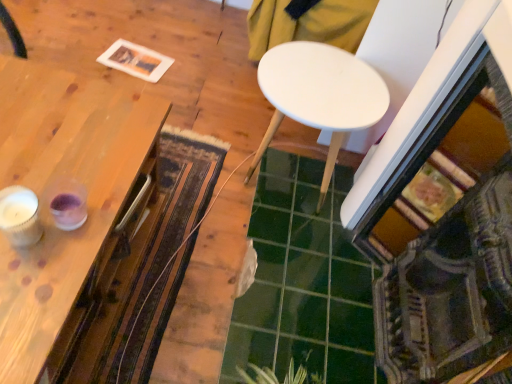
Question: Is green glossy tile at center aimed at white matte table at center, marked as the 2th table in a left-to-right arrangement?

Choices:
 (A) no
 (B) yes

Answer: (A)

Question: Is green glossy tile at center not within white matte table at center, which appears as the 1th table when viewed from the right?

Choices:
 (A) yes
 (B) no

Answer: (A)

Question: Considering the relative sizes of green glossy tile at center and white matte table at center, which appears as the 1th table when viewed from the right, in the image provided, is green glossy tile at center taller than white matte table at center, which appears as the 1th table when viewed from the right,?

Choices:
 (A) no
 (B) yes

Answer: (A)

Question: Can you confirm if green glossy tile at center is wider than white matte table at center, marked as the 2th table in a left-to-right arrangement?

Choices:
 (A) yes
 (B) no

Answer: (A)

Question: Are green glossy tile at center and white matte table at center, which appears as the 1th table when viewed from the right, making contact?

Choices:
 (A) no
 (B) yes

Answer: (A)

Question: Can you confirm if green glossy tile at center is thinner than white matte table at center, which appears as the 1th table when viewed from the right?

Choices:
 (A) no
 (B) yes

Answer: (A)

Question: Is green leafy plant at lower center positioned with its back to textured woolen mat at center?

Choices:
 (A) no
 (B) yes

Answer: (A)

Question: From the image's perspective, is green leafy plant at lower center beneath textured woolen mat at center?

Choices:
 (A) yes
 (B) no

Answer: (A)

Question: Does green leafy plant at lower center have a smaller size compared to textured woolen mat at center?

Choices:
 (A) yes
 (B) no

Answer: (A)

Question: Can you confirm if green leafy plant at lower center is thinner than textured woolen mat at center?

Choices:
 (A) no
 (B) yes

Answer: (B)

Question: Is green leafy plant at lower center at the left side of textured woolen mat at center?

Choices:
 (A) yes
 (B) no

Answer: (B)

Question: Is the depth of green leafy plant at lower center greater than that of textured woolen mat at center?

Choices:
 (A) yes
 (B) no

Answer: (B)

Question: Can you confirm if textured woolen mat at center is shorter than green glossy tile at center?

Choices:
 (A) yes
 (B) no

Answer: (A)